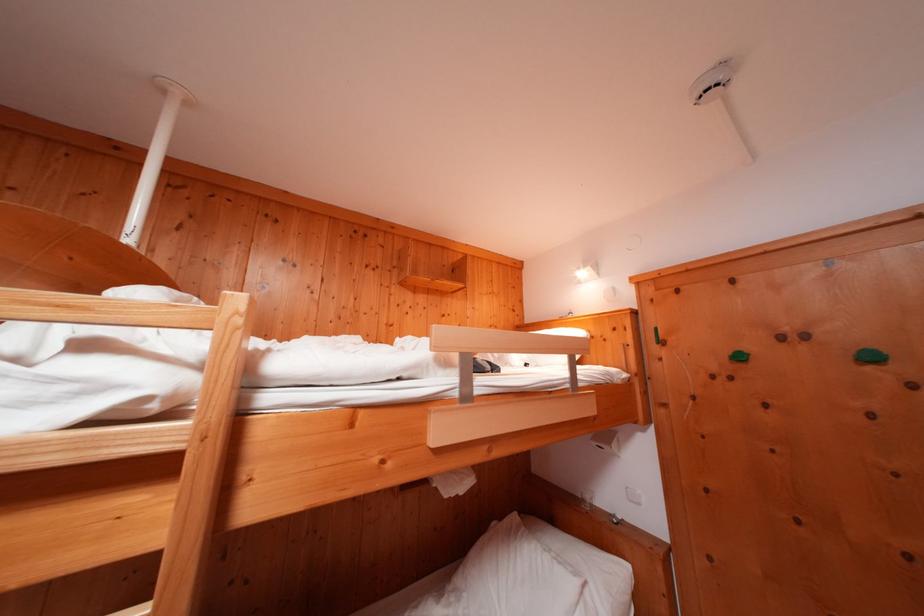
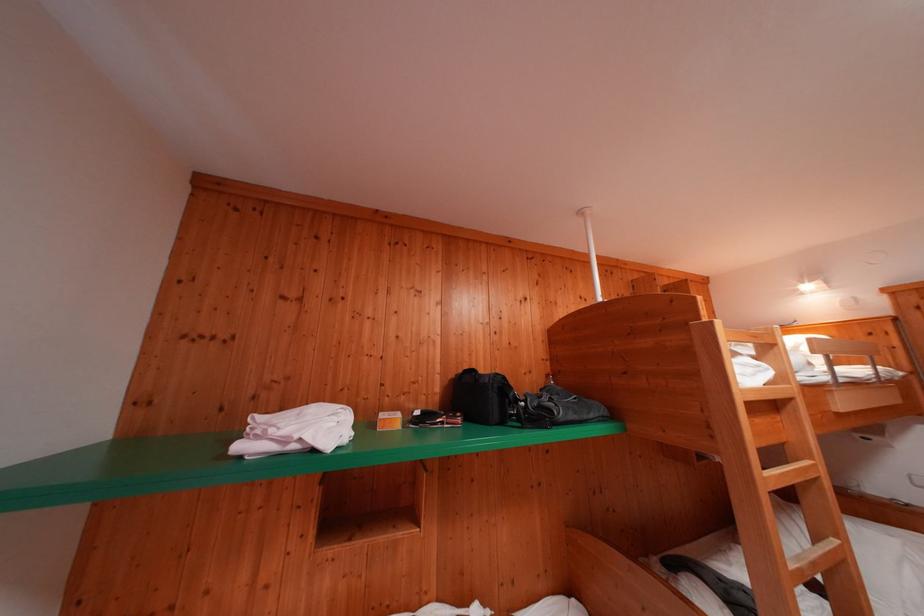
Which direction would the cameraman need to move to produce the second image?

The movement direction of the cameraman is left, backward.